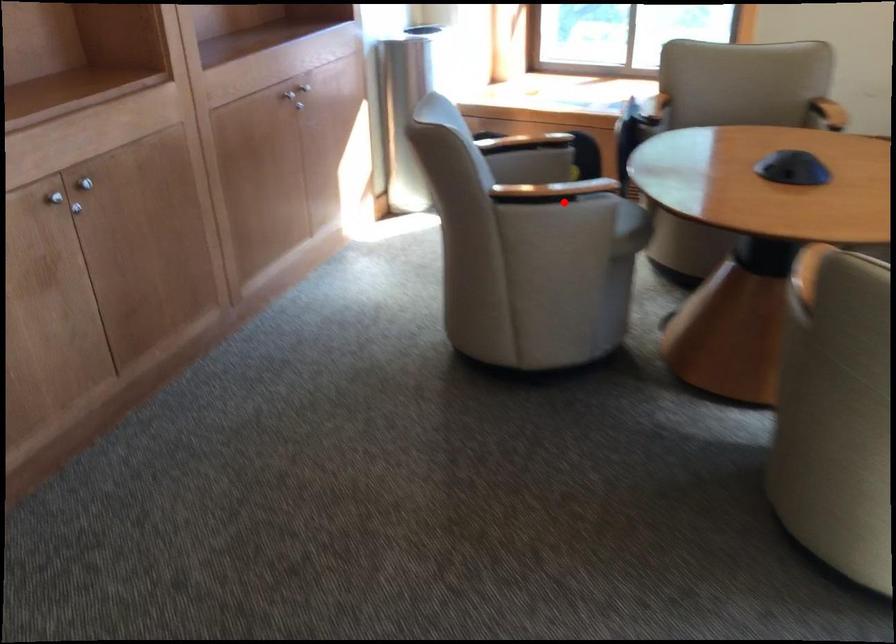
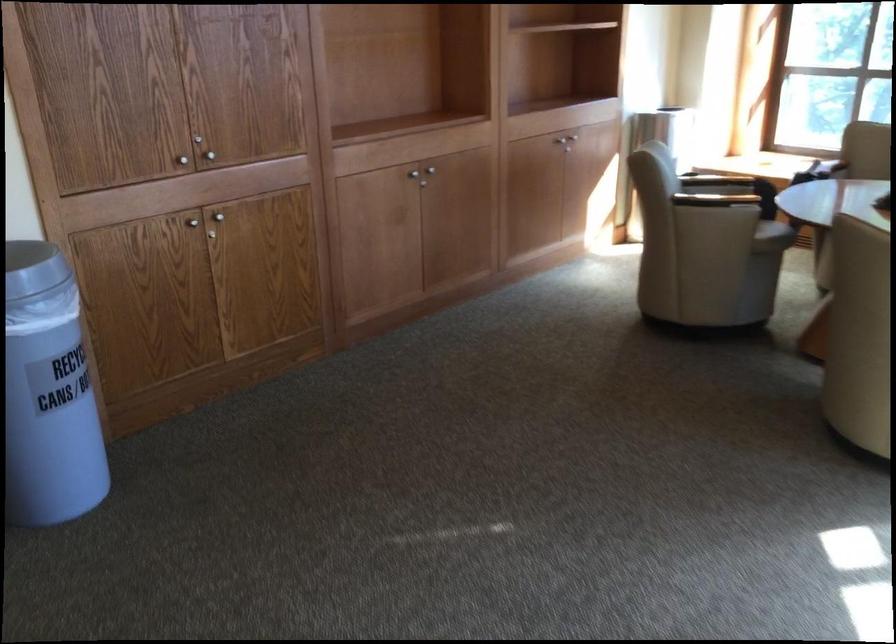
Locate, in the second image, the point that corresponds to the highlighted location in the first image.

(726, 202)